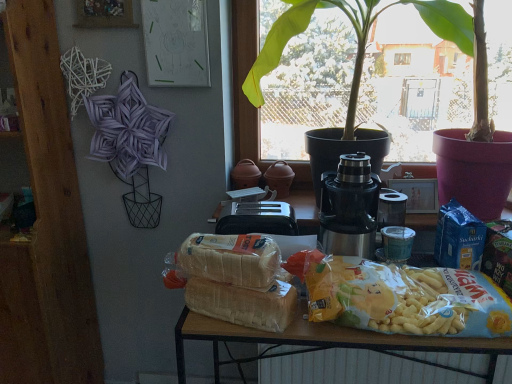
What do you see at coordinates (355, 30) in the screenshot? The width and height of the screenshot is (512, 384). I see `green leafy plant at center` at bounding box center [355, 30].

Describe the element at coordinates (349, 207) in the screenshot. I see `satin silver thermos at center, placed as the 2th yoghurt when sorted from right to left` at that location.

Measure the distance between point (x=333, y=190) and camera.

Point (x=333, y=190) and camera are 3.95 feet apart from each other.

What do you see at coordinates (231, 259) in the screenshot?
I see `translucent plastic bag of chips at center, arranged as the first yoghurt when viewed from the left` at bounding box center [231, 259].

Identify the location of matte paper drawing at upper center. The width and height of the screenshot is (512, 384). (176, 43).

At what (x,y) coordinates should I click in order to perform the action: click on wooden bookshelf at left. Please return your answer as a coordinate pair (x, y). Looking at the image, I should click on (46, 223).

Considering the sizes of satin silver thermos at center, placed as the 2th yoghurt when sorted from right to left, and translucent plastic bag of chips at center, which is counted as the 3th yoghurt, starting from the right, in the image, is satin silver thermos at center, placed as the 2th yoghurt when sorted from right to left, taller or shorter than translucent plastic bag of chips at center, which is counted as the 3th yoghurt, starting from the right,?

In the image, satin silver thermos at center, placed as the 2th yoghurt when sorted from right to left, appears to be taller than translucent plastic bag of chips at center, which is counted as the 3th yoghurt, starting from the right.

Who is smaller, satin silver thermos at center, the second yoghurt from the left, or translucent plastic bag of chips at center, arranged as the first yoghurt when viewed from the left?

Smaller between the two is translucent plastic bag of chips at center, arranged as the first yoghurt when viewed from the left.

Can you see satin silver thermos at center, the second yoghurt from the left, touching translucent plastic bag of chips at center, which is counted as the 3th yoghurt, starting from the right?

There is a gap between satin silver thermos at center, the second yoghurt from the left, and translucent plastic bag of chips at center, which is counted as the 3th yoghurt, starting from the right.

Does satin silver thermos at center, the second yoghurt from the left, contain translucent plastic bag of chips at center, which is counted as the 3th yoghurt, starting from the right?

Definitely not — translucent plastic bag of chips at center, which is counted as the 3th yoghurt, starting from the right, is not inside satin silver thermos at center, the second yoghurt from the left.

Could you tell me if wooden bookshelf at left is turned towards green leafy plant at center?

No, wooden bookshelf at left does not turn towards green leafy plant at center.

From the image's perspective, which is below, wooden bookshelf at left or green leafy plant at center?

wooden bookshelf at left is shown below in the image.

Can you confirm if wooden bookshelf at left is smaller than green leafy plant at center?

Yes, wooden bookshelf at left is smaller than green leafy plant at center.

Considering their positions, is matte plastic table at center located in front of or behind yellow matte snack at center?

Visually, matte plastic table at center is located behind yellow matte snack at center.

Would you say matte plastic table at center contains yellow matte snack at center?

Definitely not — yellow matte snack at center is not inside matte plastic table at center.

Measure the distance between matte plastic table at center and yellow matte snack at center.

matte plastic table at center and yellow matte snack at center are 10.56 centimeters apart from each other.

Is the surface of matte plastic table at center in direct contact with yellow matte snack at center?

matte plastic table at center and yellow matte snack at center are clearly separated.

Is point (221, 235) more distant than point (352, 22)?

No, it is in front of (352, 22).

Relative to green leafy plant at center, is translucent plastic bag of chips at center, which is counted as the 3th yoghurt, starting from the right, in front or behind?

Clearly, translucent plastic bag of chips at center, which is counted as the 3th yoghurt, starting from the right, is behind green leafy plant at center.

From a real-world perspective, is translucent plastic bag of chips at center, arranged as the first yoghurt when viewed from the left, physically located above or below green leafy plant at center?

translucent plastic bag of chips at center, arranged as the first yoghurt when viewed from the left, is below green leafy plant at center.

Are translucent plastic bag of chips at center, which is counted as the 3th yoghurt, starting from the right, and green leafy plant at center far apart?

No, translucent plastic bag of chips at center, which is counted as the 3th yoghurt, starting from the right, is in close proximity to green leafy plant at center.

From a real-world perspective, is matte paper drawing at upper center physically below wooden bookshelf at left?

Incorrect, from a real-world perspective, matte paper drawing at upper center is higher than wooden bookshelf at left.

Looking at this image, which object is wider, matte paper drawing at upper center or wooden bookshelf at left?

wooden bookshelf at left.

Is matte paper drawing at upper center far away from wooden bookshelf at left?

They are positioned close to each other.

The width and height of the screenshot is (512, 384). Identify the location of bulletin board above the wooden bookshelf at left (from a real-world perspective). (176, 43).

From the image's perspective, who appears lower, translucent plastic bag of chips at center, which is counted as the 3th yoghurt, starting from the right, or wooden bookshelf at left?

translucent plastic bag of chips at center, which is counted as the 3th yoghurt, starting from the right, from the image's perspective.

How different are the orientations of translucent plastic bag of chips at center, which is counted as the 3th yoghurt, starting from the right, and wooden bookshelf at left in degrees?

They differ by 16 degrees in their facing directions.

Is translucent plastic bag of chips at center, arranged as the first yoghurt when viewed from the left, at the right side of wooden bookshelf at left?

Yes, translucent plastic bag of chips at center, arranged as the first yoghurt when viewed from the left, is to the right of wooden bookshelf at left.

Can you confirm if translucent plastic bag of chips at center, which is counted as the 3th yoghurt, starting from the right, is thinner than wooden bookshelf at left?

Indeed, translucent plastic bag of chips at center, which is counted as the 3th yoghurt, starting from the right, has a lesser width compared to wooden bookshelf at left.

Between white textured radiator at lower center and matte paper drawing at upper center, which one has larger size?

With larger size is white textured radiator at lower center.

Considering the sizes of objects white textured radiator at lower center and matte paper drawing at upper center in the image provided, who is taller, white textured radiator at lower center or matte paper drawing at upper center?

matte paper drawing at upper center is taller.

Looking at this image, in terms of width, does white textured radiator at lower center look wider or thinner when compared to matte paper drawing at upper center?

white textured radiator at lower center is wider than matte paper drawing at upper center.

Which is nearer, (341,355) or (169,40)?

The point (169,40) is closer.

Locate an element on the screen. yoghurt located on the left of satin silver thermos at center, the second yoghurt from the left is located at coordinates (231, 259).

What are the coordinates of `houseplant in front of the wooden bookshelf at left` in the screenshot? It's located at (355, 30).

Which object lies nearer to the anchor point white textured radiator at lower center, translucent plastic bag of chips at center, arranged as the first yoghurt when viewed from the left, or matte paper drawing at upper center?

The object closer to white textured radiator at lower center is translucent plastic bag of chips at center, arranged as the first yoghurt when viewed from the left.

Considering their positions, is white textured radiator at lower center positioned closer to wooden bookshelf at left than matte paper drawing at upper center?

matte paper drawing at upper center.

When comparing their distances from satin silver thermos at center, the second yoghurt from the left, does matte plastic table at center or translucent plastic bag of chips at center, which is counted as the 3th yoghurt, starting from the right, seem closer?

translucent plastic bag of chips at center, which is counted as the 3th yoghurt, starting from the right, lies closer to satin silver thermos at center, the second yoghurt from the left, than the other object.

Looking at the image, which one is located further to blue foil packet at right, acting as the third yoghurt starting from the left, green leafy plant at center or yellow matte snack at center?

Based on the image, green leafy plant at center appears to be further to blue foil packet at right, acting as the third yoghurt starting from the left.

Based on their spatial positions, is satin silver thermos at center, the second yoghurt from the left, or translucent plastic bag of chips at center, which is counted as the 3th yoghurt, starting from the right, further from blue foil packet at right, acting as the third yoghurt starting from the left?

The object further to blue foil packet at right, acting as the third yoghurt starting from the left, is translucent plastic bag of chips at center, which is counted as the 3th yoghurt, starting from the right.

Considering their positions, is translucent plastic bag of chips at center, arranged as the first yoghurt when viewed from the left, positioned closer to blue foil packet at right, marked as the first yoghurt in a right-to-left arrangement, than white textured radiator at lower center?

Based on the image, white textured radiator at lower center appears to be nearer to blue foil packet at right, marked as the first yoghurt in a right-to-left arrangement.

Based on their spatial positions, is matte plastic table at center or white textured radiator at lower center further from yellow matte snack at center?

white textured radiator at lower center is further to yellow matte snack at center.

Estimate the real-world distances between objects in this image. Which object is further from yellow matte snack at center, matte plastic table at center or blue foil packet at right, acting as the third yoghurt starting from the left?

blue foil packet at right, acting as the third yoghurt starting from the left.

Locate an element on the screen. food between matte paper drawing at upper center and green leafy plant at center from left to right is located at coordinates (384, 298).

The image size is (512, 384). I want to click on yoghurt located between translucent plastic bag of chips at center, which is counted as the 3th yoghurt, starting from the right, and blue foil packet at right, marked as the first yoghurt in a right-to-left arrangement, in the left-right direction, so click(x=349, y=207).

Where is `houseplant between matte paper drawing at upper center and matte plastic table at center in the vertical direction`? houseplant between matte paper drawing at upper center and matte plastic table at center in the vertical direction is located at coordinates (355, 30).

The width and height of the screenshot is (512, 384). I want to click on bulletin board between wooden bookshelf at left and green leafy plant at center from left to right, so click(176, 43).